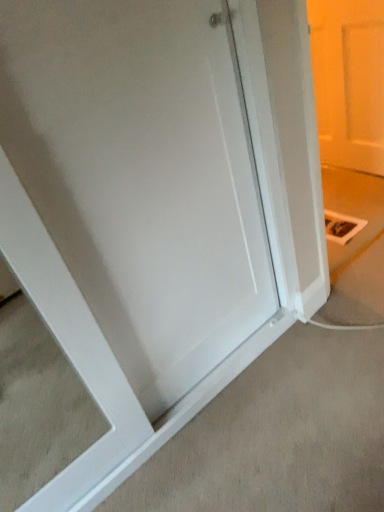
Question: Relative to white matte door at upper right, is white smooth door at center in front or behind?

Choices:
 (A) behind
 (B) front

Answer: (B)

Question: From the image's perspective, is white smooth door at center located above or below white matte door at upper right?

Choices:
 (A) above
 (B) below

Answer: (B)

Question: Is white smooth door at center wider or thinner than white matte door at upper right?

Choices:
 (A) wide
 (B) thin

Answer: (A)

Question: Considering the positions of white matte door at upper right and white smooth door at center in the image, is white matte door at upper right taller or shorter than white smooth door at center?

Choices:
 (A) short
 (B) tall

Answer: (B)

Question: From a real-world perspective, is white matte door at upper right positioned above or below white smooth door at center?

Choices:
 (A) above
 (B) below

Answer: (A)

Question: Considering their positions, is white matte door at upper right located in front of or behind white smooth door at center?

Choices:
 (A) front
 (B) behind

Answer: (B)

Question: Choose the correct answer: Is white matte door at upper right inside white smooth door at center or outside it?

Choices:
 (A) outside
 (B) inside

Answer: (A)